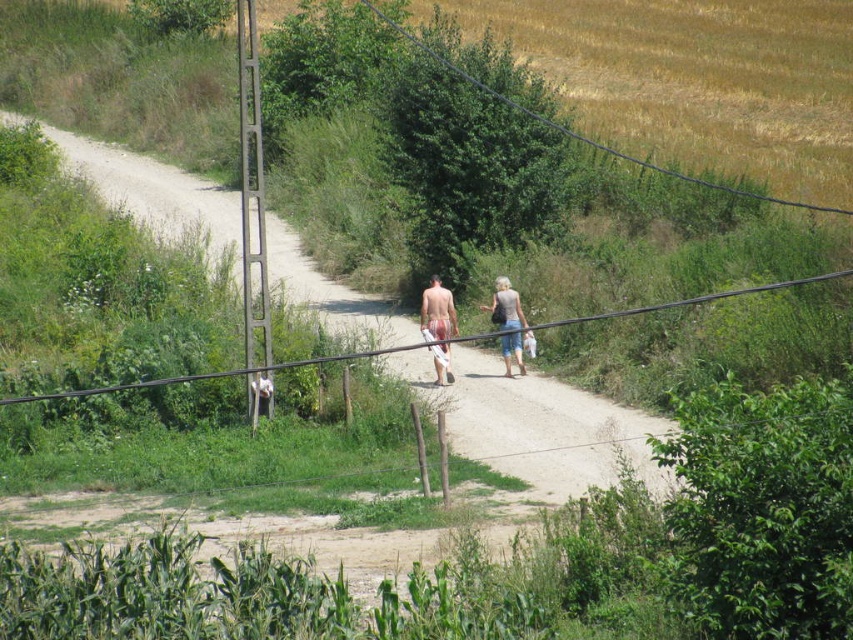
Can you confirm if black wire at center is shorter than white cotton shirt at center?

In fact, black wire at center may be taller than white cotton shirt at center.

Between black wire at center and white cotton shirt at center, which one is positioned lower?

white cotton shirt at center

Is point (683, 301) behind point (258, 397)?

Yes, it is.

Locate an element on the screen. The width and height of the screenshot is (853, 640). black wire at center is located at coordinates (212, 374).

Based on the photo, can you confirm if black wire at center is bigger than white towel at center?

Yes, black wire at center is bigger than white towel at center.

Who is more distant from viewer, (309, 358) or (456, 332)?

Positioned behind is point (456, 332).

Is point (62, 394) more distant than point (444, 346)?

No, (62, 394) is in front of (444, 346).

Image resolution: width=853 pixels, height=640 pixels. Identify the location of black wire at center. (212, 374).

At what (x,y) coordinates should I click in order to perform the action: click on matte white shorts at center. Please return your answer as a coordinate pair (x, y). Looking at the image, I should click on (438, 324).

Based on the photo, does matte white shorts at center come in front of white cotton shirt at center?

No.

Who is more forward, (497, 296) or (253, 381)?

Point (253, 381) is more forward.

Locate an element on the screen. The width and height of the screenshot is (853, 640). matte white shorts at center is located at coordinates pyautogui.click(x=438, y=324).